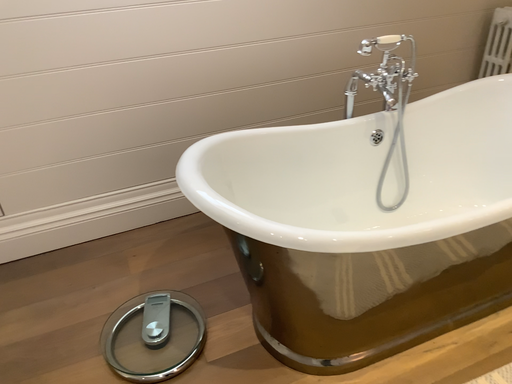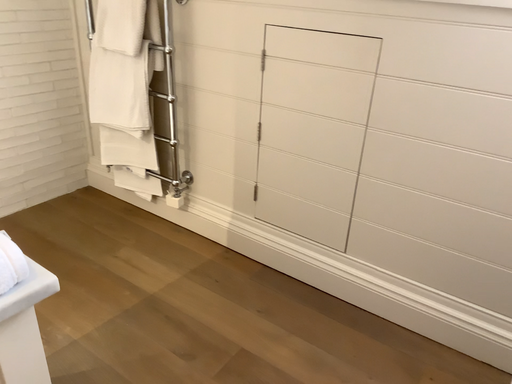
Question: How did the camera likely rotate when shooting the video?

Choices:
 (A) rotated left
 (B) rotated right

Answer: (A)